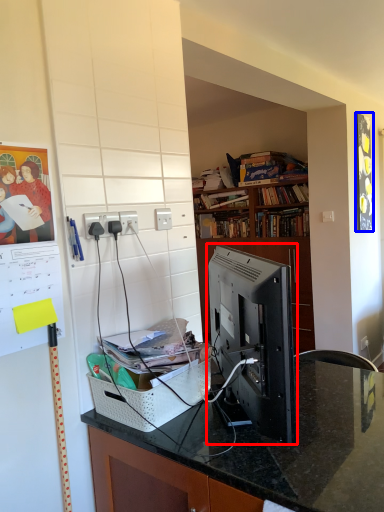
Question: Which object is further to the camera taking this photo, desktop computer (highlighted by a red box) or picture frame (highlighted by a blue box)?

Choices:
 (A) desktop computer
 (B) picture frame

Answer: (B)